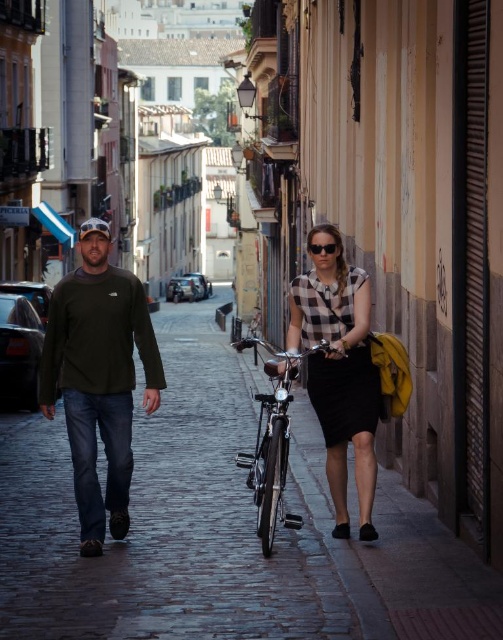
Who is positioned more to the right, cobblestone pavement at center or dark green fleece at center?

Positioned to the right is dark green fleece at center.

Can you confirm if cobblestone pavement at center is thinner than dark green fleece at center?

No, cobblestone pavement at center is not thinner than dark green fleece at center.

Who is more forward, (x=181, y=344) or (x=73, y=419)?

Point (x=73, y=419) is in front.

Identify the location of cobblestone pavement at center. This screenshot has width=503, height=640. (161, 520).

Does cobblestone pavement at center have a larger size compared to matte black sunglasses at center?

Indeed, cobblestone pavement at center has a larger size compared to matte black sunglasses at center.

Between cobblestone pavement at center and matte black sunglasses at center, which one is positioned lower?

cobblestone pavement at center is lower down.

Locate an element on the screen. Image resolution: width=503 pixels, height=640 pixels. cobblestone pavement at center is located at coordinates (161, 520).

Find the location of a particular element. This screenshot has height=640, width=503. cobblestone pavement at center is located at coordinates 161,520.

Identify the location of dark green fleece at center. Image resolution: width=503 pixels, height=640 pixels. (99, 378).

Describe the element at coordinates (99, 378) in the screenshot. I see `dark green fleece at center` at that location.

Which is in front, point (89, 444) or point (282, 380)?

Point (89, 444) is in front.

What are the coordinates of `dark green fleece at center` in the screenshot? It's located at (99, 378).